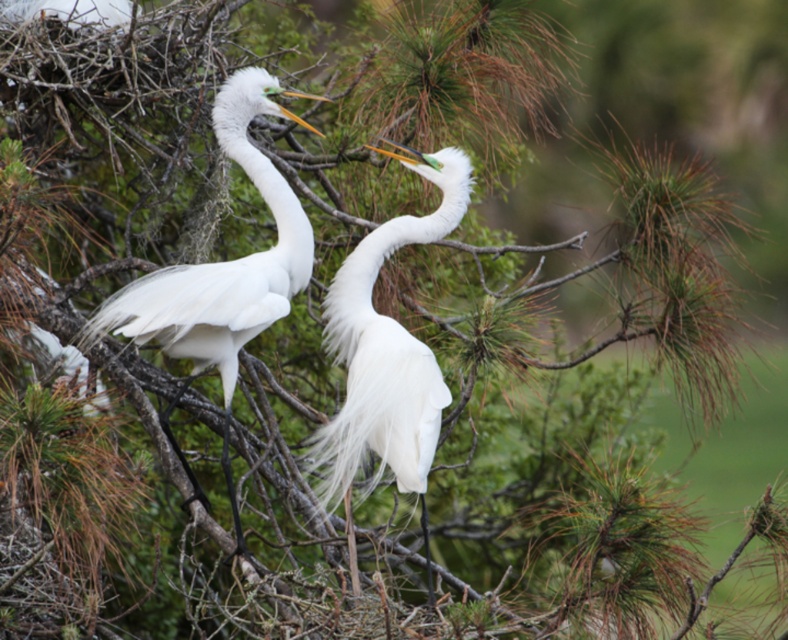
Question: Can you confirm if white fluffy egret at center is smaller than white feathered egret at center?

Choices:
 (A) yes
 (B) no

Answer: (A)

Question: Is white fluffy egret at center below white feathered egret at center?

Choices:
 (A) no
 (B) yes

Answer: (B)

Question: Which point is farther from the camera taking this photo?

Choices:
 (A) (127, 320)
 (B) (433, 445)

Answer: (A)

Question: Which point appears farthest from the camera in this image?

Choices:
 (A) pos(430,410)
 (B) pos(136,312)

Answer: (B)

Question: Is white fluffy egret at center wider than white feathered egret at center?

Choices:
 (A) yes
 (B) no

Answer: (B)